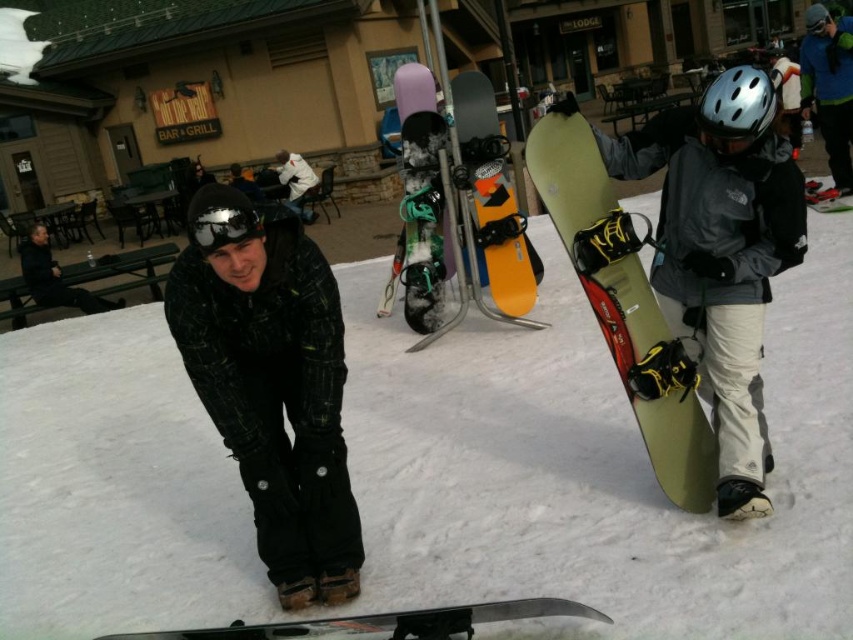
Who is more distant from viewer, [483,592] or [712,124]?

The point [483,592] is more distant.

Who is higher up, white matte snowboard at center or silver metallic helmet at upper center?

silver metallic helmet at upper center is higher up.

What are the coordinates of `white matte snowboard at center` in the screenshot? It's located at (596, 465).

Is matte black snowboard at center closer to the viewer compared to white matte jacket at upper center?

Yes, matte black snowboard at center is in front of white matte jacket at upper center.

Does matte black snowboard at center have a smaller size compared to white matte jacket at upper center?

Yes, matte black snowboard at center is smaller than white matte jacket at upper center.

Who is more distant from viewer, [424,250] or [309,188]?

The point [309,188] is more distant.

At what (x,y) coordinates should I click in order to perform the action: click on matte black snowboard at center. Please return your answer as a coordinate pair (x, y). This screenshot has width=853, height=640. Looking at the image, I should click on (421, 200).

Who is positioned more to the right, dark gray jacket at left or orange matte snowboard at center?

Positioned to the right is orange matte snowboard at center.

Which is in front, point (47, 260) or point (491, 96)?

Point (491, 96) is in front.

Locate an element on the screen. This screenshot has height=640, width=853. dark gray jacket at left is located at coordinates (54, 276).